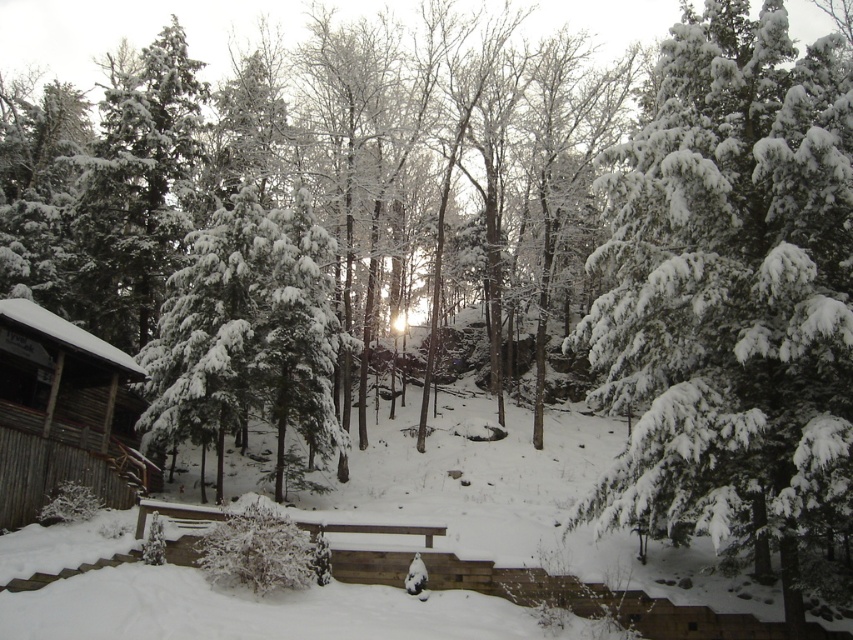
Is point (698, 316) positioned before point (25, 444)?

That is True.

Looking at this image, is snow-covered evergreen at center positioned before wooden cabin at left?

Yes, snow-covered evergreen at center is in front of wooden cabin at left.

Measure the distance between point (x=836, y=360) and camera.

11.68 meters

At what (x,y) coordinates should I click in order to perform the action: click on snow-covered evergreen at center. Please return your answer as a coordinate pair (x, y). This screenshot has width=853, height=640. Looking at the image, I should click on (730, 294).